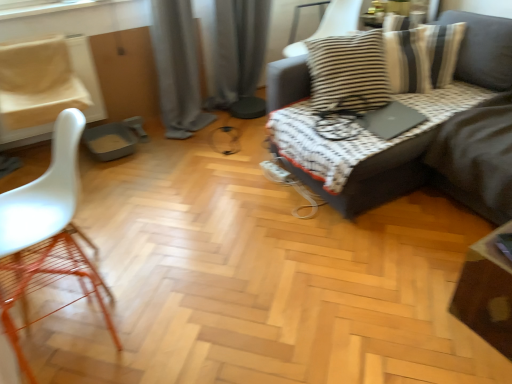
The width and height of the screenshot is (512, 384). What are the coordinates of `blank space to the left of wooden table at lower right` in the screenshot? It's located at (430, 322).